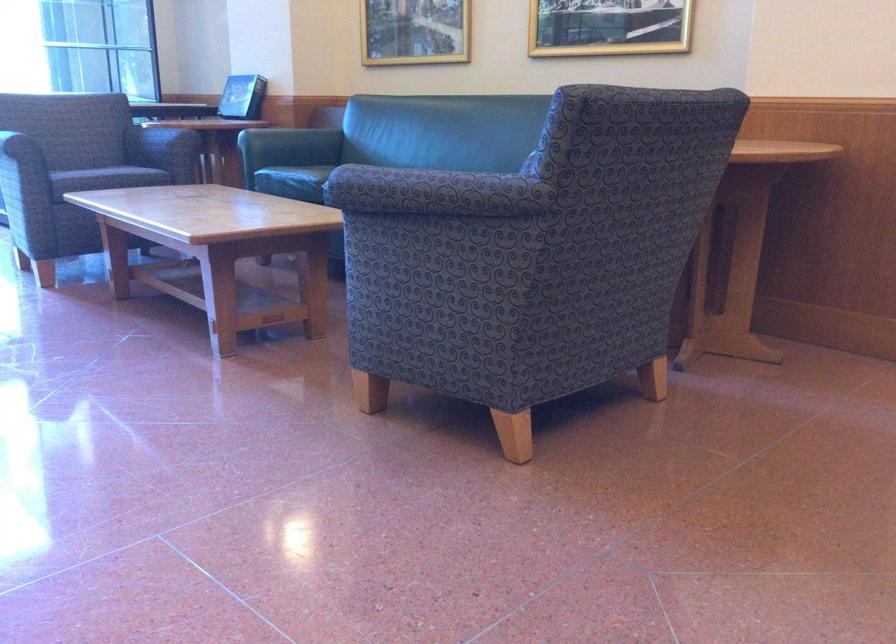
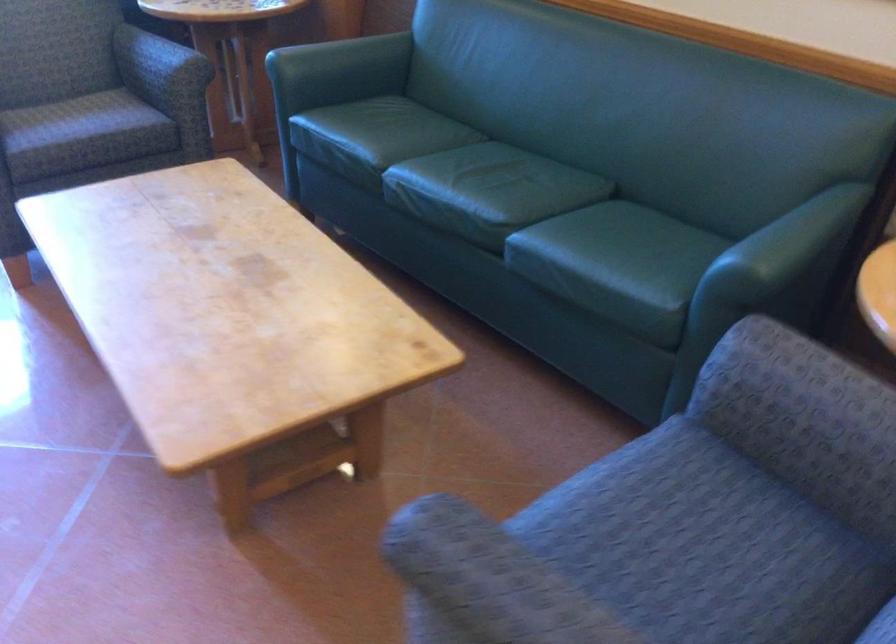
Find the pixel in the second image that matches point (90, 163) in the first image.

(65, 118)